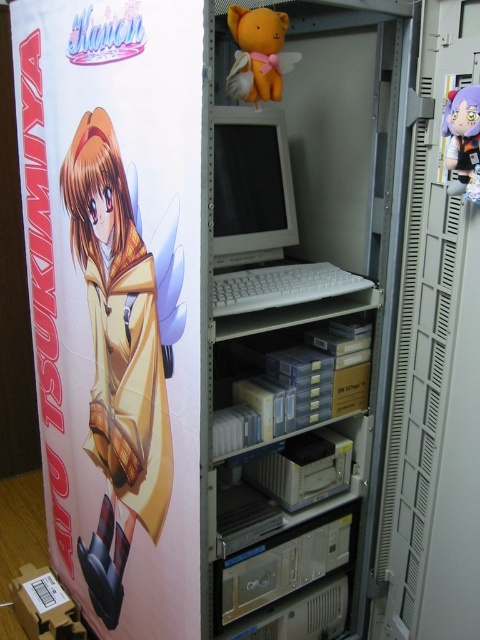
You are standing in front of the storage cabinet and notice the matte paper poster at left. Can you determine its exact location using coordinates?

The matte paper poster at left is located at coordinates point (116, 298).

You are standing in front of the storage cabinet and notice the matte paper poster at left and the matte yellow plush at upper center. Which object is nearer to you?

The matte paper poster at left is closer to the viewer than the matte yellow plush at upper center, so the matte paper poster at left is nearer to you.